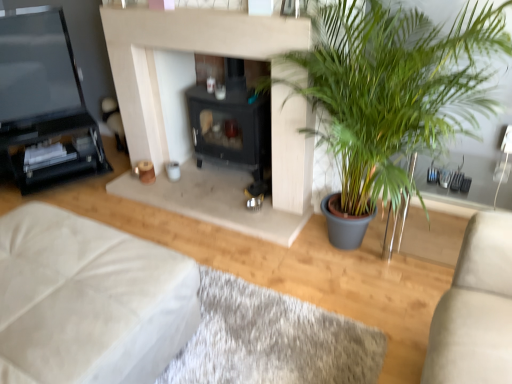
Question: In the image, is matte black tv at left positioned in front of or behind green leafy plant at right?

Choices:
 (A) front
 (B) behind

Answer: (B)

Question: Considering the positions of matte black tv at left and green leafy plant at right in the image, is matte black tv at left bigger or smaller than green leafy plant at right?

Choices:
 (A) big
 (B) small

Answer: (B)

Question: Estimate the real-world distances between objects in this image. Which object is farther from the black matte fireplace at center?

Choices:
 (A) white fabric ottoman at lower left
 (B) white fabric at lower left
 (C) matte black tv at left
 (D) green leafy plant at right

Answer: (A)

Question: Considering the real-world distances, which object is farthest from the white fabric at lower left?

Choices:
 (A) matte black tv at left
 (B) green leafy plant at right
 (C) white fabric ottoman at lower left
 (D) black matte fireplace at center

Answer: (A)